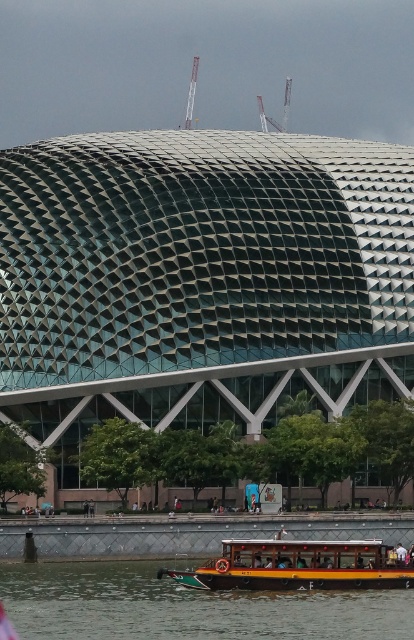
Looking at this image, can you confirm if green wooden boat at lower center is shorter than wooden polished boat at lower center?

Yes.

Looking at this image, which of these two, green wooden boat at lower center or wooden polished boat at lower center, stands taller?

With more height is wooden polished boat at lower center.

Is point (248, 598) positioned after point (322, 582)?

No, (248, 598) is in front of (322, 582).

Where is `green wooden boat at lower center`? Image resolution: width=414 pixels, height=640 pixels. green wooden boat at lower center is located at coordinates (185, 605).